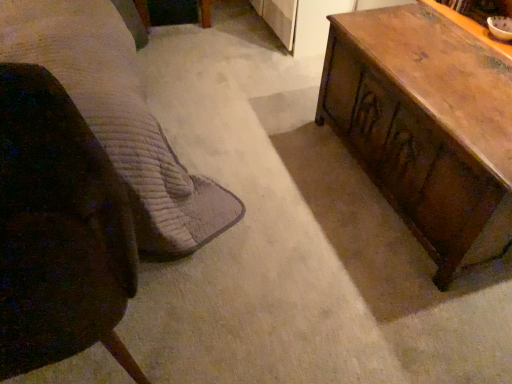
Question: Considering the relative positions of dark brown leather chair at left and brown quilted fabric bed at left in the image provided, is dark brown leather chair at left in front of brown quilted fabric bed at left?

Choices:
 (A) no
 (B) yes

Answer: (B)

Question: Does dark brown leather chair at left appear on the left side of brown quilted fabric bed at left?

Choices:
 (A) no
 (B) yes

Answer: (A)

Question: Considering the relative sizes of dark brown leather chair at left and brown quilted fabric bed at left in the image provided, is dark brown leather chair at left taller than brown quilted fabric bed at left?

Choices:
 (A) yes
 (B) no

Answer: (B)

Question: From a real-world perspective, is dark brown leather chair at left beneath brown quilted fabric bed at left?

Choices:
 (A) no
 (B) yes

Answer: (B)

Question: Is dark brown leather chair at left oriented towards brown quilted fabric bed at left?

Choices:
 (A) no
 (B) yes

Answer: (A)

Question: Are dark brown leather chair at left and brown quilted fabric bed at left far apart?

Choices:
 (A) no
 (B) yes

Answer: (A)

Question: Does brown quilted fabric bed at left come behind dark brown leather chair at left?

Choices:
 (A) yes
 (B) no

Answer: (A)

Question: Is brown quilted fabric bed at left not close to dark brown leather chair at left?

Choices:
 (A) no
 (B) yes

Answer: (A)

Question: Would you say brown quilted fabric bed at left is outside dark brown leather chair at left?

Choices:
 (A) yes
 (B) no

Answer: (A)

Question: Considering the relative sizes of brown quilted fabric bed at left and dark brown leather chair at left in the image provided, is brown quilted fabric bed at left taller than dark brown leather chair at left?

Choices:
 (A) no
 (B) yes

Answer: (B)

Question: Is brown quilted fabric bed at left thinner than dark brown leather chair at left?

Choices:
 (A) no
 (B) yes

Answer: (A)

Question: From a real-world perspective, does brown quilted fabric bed at left stand above dark brown leather chair at left?

Choices:
 (A) no
 (B) yes

Answer: (B)

Question: Considering the relative positions of brown quilted fabric bed at left and wooden trunk at right in the image provided, is brown quilted fabric bed at left to the right of wooden trunk at right from the viewer's perspective?

Choices:
 (A) no
 (B) yes

Answer: (A)